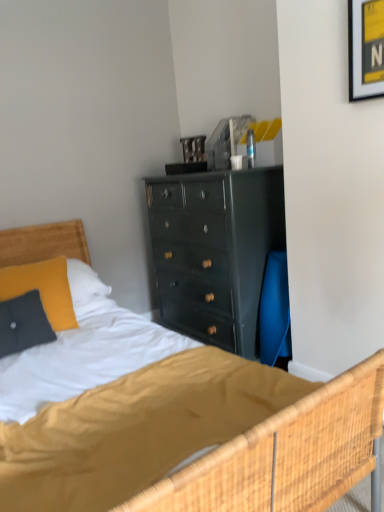
Question: Is wooden headboard at left a part of velvety yellow pillow at left?

Choices:
 (A) no
 (B) yes

Answer: (A)

Question: Considering the relative sizes of velvety yellow pillow at left and wooden headboard at left in the image provided, is velvety yellow pillow at left smaller than wooden headboard at left?

Choices:
 (A) yes
 (B) no

Answer: (A)

Question: Does velvety yellow pillow at left have a lesser width compared to wooden headboard at left?

Choices:
 (A) yes
 (B) no

Answer: (A)

Question: Is velvety yellow pillow at left to the left of wooden headboard at left from the viewer's perspective?

Choices:
 (A) yes
 (B) no

Answer: (B)

Question: Can you confirm if velvety yellow pillow at left is taller than wooden headboard at left?

Choices:
 (A) no
 (B) yes

Answer: (A)

Question: Is velvety yellow pillow at left oriented towards wooden headboard at left?

Choices:
 (A) no
 (B) yes

Answer: (B)

Question: Does wooden headboard at left have a lesser width compared to yellow paper at upper right?

Choices:
 (A) no
 (B) yes

Answer: (A)

Question: Is yellow paper at upper right surrounded by wooden headboard at left?

Choices:
 (A) yes
 (B) no

Answer: (B)

Question: Is wooden headboard at left next to yellow paper at upper right?

Choices:
 (A) no
 (B) yes

Answer: (A)

Question: Does wooden headboard at left have a greater height compared to yellow paper at upper right?

Choices:
 (A) yes
 (B) no

Answer: (A)

Question: Is wooden headboard at left to the left of yellow paper at upper right from the viewer's perspective?

Choices:
 (A) yes
 (B) no

Answer: (A)

Question: Is wooden headboard at left wider than yellow paper at upper right?

Choices:
 (A) no
 (B) yes

Answer: (B)

Question: Considering the relative positions of yellow paper at upper right and wooden headboard at left in the image provided, is yellow paper at upper right in front of wooden headboard at left?

Choices:
 (A) no
 (B) yes

Answer: (B)